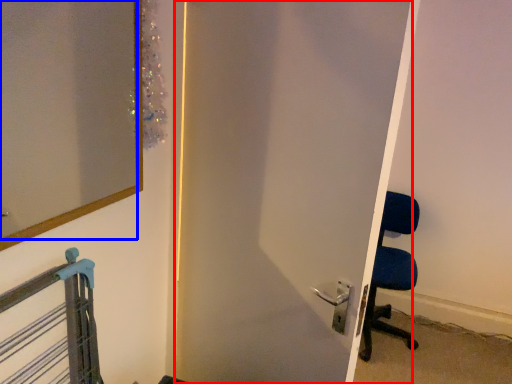
Question: Which point is closer to the camera, door (highlighted by a red box) or mirror (highlighted by a blue box)?

Choices:
 (A) door
 (B) mirror

Answer: (B)